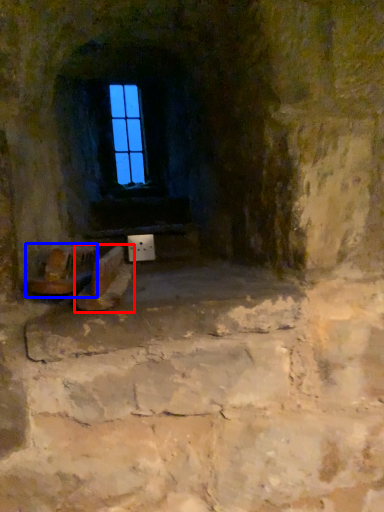
Question: Which of the following is the closest to the observer, footwear (highlighted by a red box) or chair (highlighted by a blue box)?

Choices:
 (A) footwear
 (B) chair

Answer: (A)